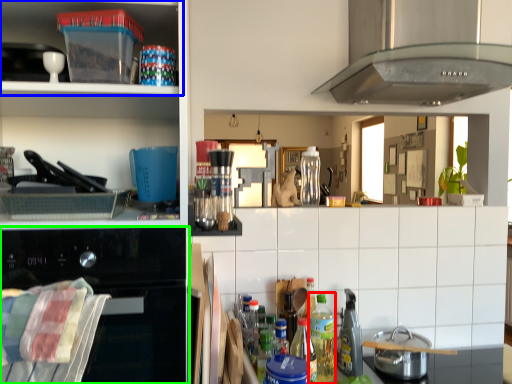
Question: Based on their relative distances, which object is nearer to bottle (highlighted by a red box)? Choose from shelf (highlighted by a blue box) and home appliance (highlighted by a green box).

Choices:
 (A) shelf
 (B) home appliance

Answer: (B)